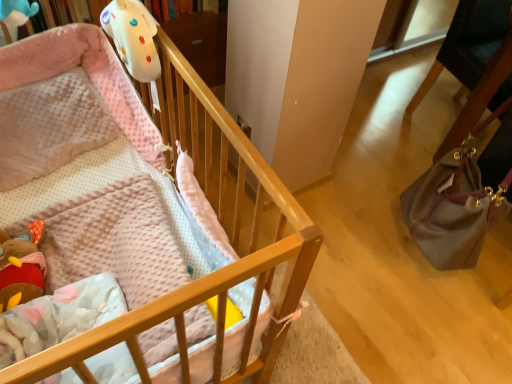
Question: Does point tap(476, 261) appear closer or farther from the camera than point tap(244, 162)?

Choices:
 (A) closer
 (B) farther

Answer: (B)

Question: Based on their positions, is matte brown handbag at right located to the left or right of wooden crib at upper left?

Choices:
 (A) left
 (B) right

Answer: (B)

Question: Looking at the image, does matte brown handbag at right seem bigger or smaller compared to wooden crib at upper left?

Choices:
 (A) big
 (B) small

Answer: (B)

Question: Do you think wooden crib at upper left is within matte brown handbag at right, or outside of it?

Choices:
 (A) outside
 (B) inside

Answer: (A)

Question: Looking at the image, does wooden crib at upper left seem bigger or smaller compared to matte brown handbag at right?

Choices:
 (A) big
 (B) small

Answer: (A)

Question: Considering the positions of point (99, 233) and point (410, 195), is point (99, 233) closer or farther from the camera than point (410, 195)?

Choices:
 (A) closer
 (B) farther

Answer: (A)

Question: Considering their positions, is wooden crib at upper left located in front of or behind matte brown handbag at right?

Choices:
 (A) behind
 (B) front

Answer: (B)